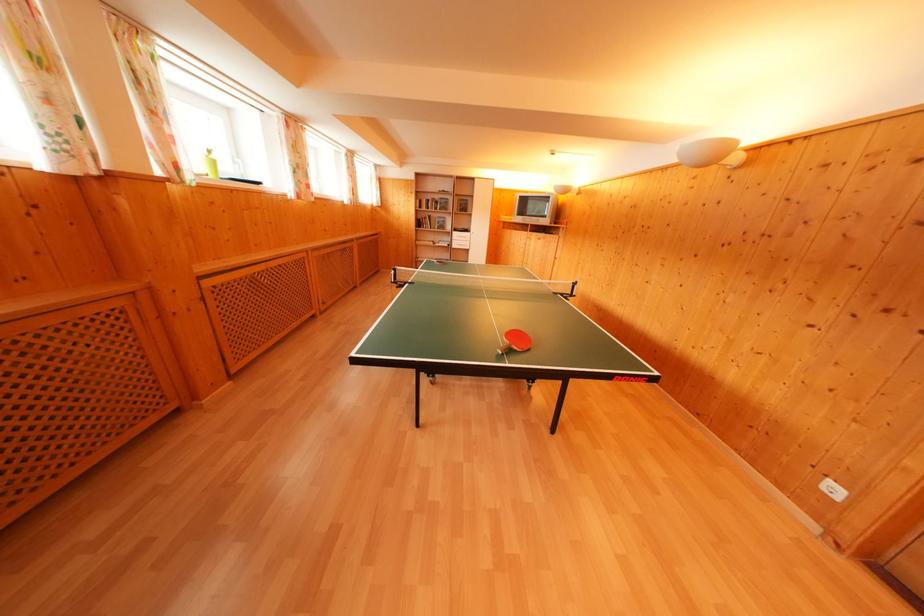
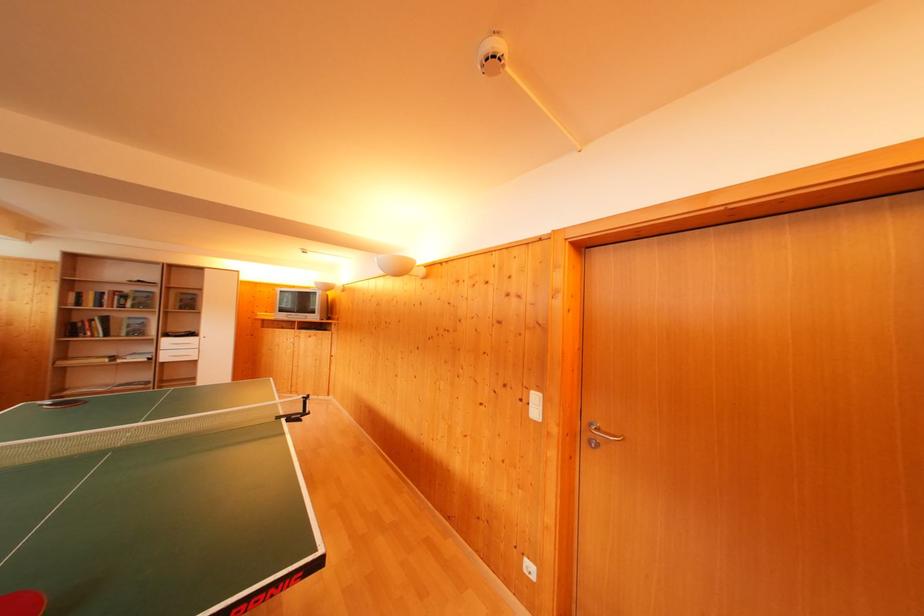
Where in the second image is the point corresponding to point 442,203 from the first image?

(131, 294)